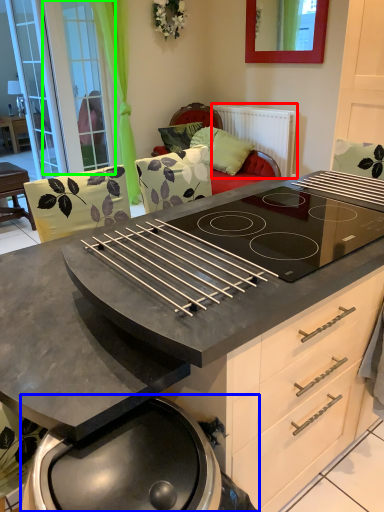
Question: Estimate the real-world distances between objects in this image. Which object is closer to radiator (highlighted by a red box), barbecue grill (highlighted by a blue box) or screen door (highlighted by a green box)?

Choices:
 (A) barbecue grill
 (B) screen door

Answer: (B)